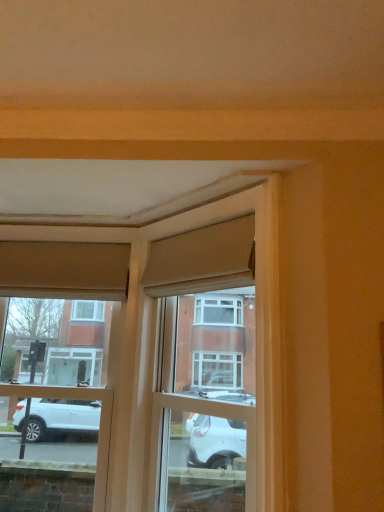
How much space does matte beige curtain at upper left, which is the first curtain from left to right, occupy vertically?

It is 14.52 inches.

What is the approximate height of matte beige curtain at upper center, which is counted as the second curtain, starting from the back?

matte beige curtain at upper center, which is counted as the second curtain, starting from the back, is 13.66 inches in height.

The height and width of the screenshot is (512, 384). What do you see at coordinates (64, 269) in the screenshot?
I see `matte glass window at center` at bounding box center [64, 269].

Locate an element on the screen. This screenshot has width=384, height=512. matte wood window frame at center is located at coordinates (257, 298).

At what (x,y) coordinates should I click in order to perform the action: click on matte beige curtain at upper left, marked as the 1th curtain in a back-to-front arrangement. Please return your answer as a coordinate pair (x, y). The width and height of the screenshot is (384, 512). Looking at the image, I should click on (64, 270).

Is point (199, 252) more distant than point (281, 452)?

That is True.

Which of these two, matte beige curtain at upper center, the second curtain in the left-to-right sequence, or matte wood window frame at center, is wider?

matte wood window frame at center.

Considering the positions of objects matte beige curtain at upper center, the first curtain positioned from the right, and matte wood window frame at center in the image provided, who is behind, matte beige curtain at upper center, the first curtain positioned from the right, or matte wood window frame at center?

matte beige curtain at upper center, the first curtain positioned from the right, is behind.

Would you say matte beige curtain at upper center, the second curtain in the left-to-right sequence, is to the left or to the right of matte wood window frame at center in the picture?

Based on their positions, matte beige curtain at upper center, the second curtain in the left-to-right sequence, is located to the left of matte wood window frame at center.

Would you say matte wood window frame at center is a long distance from matte beige curtain at upper center, which is counted as the second curtain, starting from the back?

No, matte wood window frame at center is not far from matte beige curtain at upper center, which is counted as the second curtain, starting from the back.

Does point (277, 234) come farther from viewer compared to point (147, 284)?

No.

From a real-world perspective, count 2nd curtains upward from the matte wood window frame at center and point to it. Please provide its 2D coordinates.

[(202, 259)]

The width and height of the screenshot is (384, 512). What are the coordinates of `window below the matte wood window frame at center (from a real-world perspective)` in the screenshot? It's located at [x=64, y=269].

From a real-world perspective, which object rests below the other?

matte glass window at center.

Based on their sizes in the image, would you say matte glass window at center is bigger or smaller than matte wood window frame at center?

matte glass window at center is smaller than matte wood window frame at center.

Are matte glass window at center and matte wood window frame at center making contact?

No, matte glass window at center is not touching matte wood window frame at center.

How far apart are matte glass window at center and matte beige curtain at upper center, the first curtain positioned from the right?

55.81 centimeters.

Considering the sizes of objects matte glass window at center and matte beige curtain at upper center, acting as the 1th curtain starting from the front, in the image provided, who is thinner, matte glass window at center or matte beige curtain at upper center, acting as the 1th curtain starting from the front,?

With smaller width is matte beige curtain at upper center, acting as the 1th curtain starting from the front.

At what (x,y) coordinates should I click in order to perform the action: click on curtain in front of the matte glass window at center. Please return your answer as a coordinate pair (x, y). This screenshot has height=512, width=384. Looking at the image, I should click on (202, 259).

How different are the orientations of matte glass window at center and matte beige curtain at upper center, which is counted as the second curtain, starting from the back, in degrees?

45.3 degrees separate the facing orientations of matte glass window at center and matte beige curtain at upper center, which is counted as the second curtain, starting from the back.

At what (x,y) coordinates should I click in order to perform the action: click on window frame directly beneath the matte beige curtain at upper left, marked as the 2th curtain in a front-to-back arrangement (from a real-world perspective). Please return your answer as a coordinate pair (x, y). The image size is (384, 512). Looking at the image, I should click on (257, 298).

How different are the orientations of matte wood window frame at center and matte beige curtain at upper left, the 2th curtain viewed from the right, in degrees?

matte wood window frame at center and matte beige curtain at upper left, the 2th curtain viewed from the right, are facing 45.3 degrees away from each other.

Which of these two, matte wood window frame at center or matte beige curtain at upper left, the 2th curtain viewed from the right, is bigger?

matte wood window frame at center is bigger.

Which is more to the left, matte wood window frame at center or matte beige curtain at upper left, which is the first curtain from left to right?

matte beige curtain at upper left, which is the first curtain from left to right, is more to the left.

From the image's perspective, is matte glass window at center positioned above or below matte beige curtain at upper left, marked as the 1th curtain in a back-to-front arrangement?

matte glass window at center is situated lower than matte beige curtain at upper left, marked as the 1th curtain in a back-to-front arrangement, in the image.

Does point (97, 503) lie behind point (108, 262)?

No, (97, 503) is closer to viewer.

Would you say matte glass window at center is to the left or to the right of matte beige curtain at upper left, marked as the 1th curtain in a back-to-front arrangement, in the picture?

In the image, matte glass window at center appears on the left side of matte beige curtain at upper left, marked as the 1th curtain in a back-to-front arrangement.

Is matte glass window at center placed right next to matte beige curtain at upper left, the 2th curtain viewed from the right?

Yes, matte glass window at center and matte beige curtain at upper left, the 2th curtain viewed from the right, clearly make contact.

From a real-world perspective, between matte beige curtain at upper center, the first curtain positioned from the right, and matte glass window at center, who is vertically higher?

matte beige curtain at upper center, the first curtain positioned from the right, is physically above.

Is matte beige curtain at upper center, the second curtain in the left-to-right sequence, surrounding matte glass window at center?

No, matte glass window at center is not surrounded by matte beige curtain at upper center, the second curtain in the left-to-right sequence.

Find the location of a particular element. the 2nd curtain to the right when counting from the matte glass window at center is located at coordinates (202, 259).

This screenshot has height=512, width=384. I want to click on window frame in front of the matte beige curtain at upper center, acting as the 1th curtain starting from the front, so click(257, 298).

You are a GUI agent. You are given a task and a screenshot of the screen. Output one action in this format:
    pyautogui.click(x=<x>, y=<y>)
    Task: Click on the 2nd curtain above the matte wood window frame at center (from the image's perspective)
    The width and height of the screenshot is (384, 512).
    Given the screenshot: What is the action you would take?
    pyautogui.click(x=202, y=259)

Estimate the real-world distances between objects in this image. Which object is further from matte wood window frame at center, matte glass window at center or matte beige curtain at upper left, marked as the 1th curtain in a back-to-front arrangement?

matte glass window at center lies further to matte wood window frame at center than the other object.

When comparing their distances from matte beige curtain at upper center, acting as the 1th curtain starting from the front, does matte wood window frame at center or matte beige curtain at upper left, which is the first curtain from left to right, seem closer?

matte wood window frame at center lies closer to matte beige curtain at upper center, acting as the 1th curtain starting from the front, than the other object.

Estimate the real-world distances between objects in this image. Which object is closer to matte glass window at center, matte wood window frame at center or matte beige curtain at upper left, marked as the 2th curtain in a front-to-back arrangement?

matte beige curtain at upper left, marked as the 2th curtain in a front-to-back arrangement, is closer to matte glass window at center.

Looking at the image, which one is located further to matte beige curtain at upper left, marked as the 1th curtain in a back-to-front arrangement, matte wood window frame at center or matte glass window at center?

The object further to matte beige curtain at upper left, marked as the 1th curtain in a back-to-front arrangement, is matte wood window frame at center.

Considering their positions, is matte beige curtain at upper left, marked as the 1th curtain in a back-to-front arrangement, positioned closer to matte glass window at center than matte beige curtain at upper center, which is counted as the second curtain, starting from the back?

matte beige curtain at upper left, marked as the 1th curtain in a back-to-front arrangement.

Based on their spatial positions, is matte glass window at center or matte beige curtain at upper left, the 2th curtain viewed from the right, closer to matte beige curtain at upper center, the second curtain in the left-to-right sequence?

The object closer to matte beige curtain at upper center, the second curtain in the left-to-right sequence, is matte beige curtain at upper left, the 2th curtain viewed from the right.

Looking at the image, which one is located further to matte wood window frame at center, matte beige curtain at upper left, the 2th curtain viewed from the right, or matte beige curtain at upper center, which is counted as the second curtain, starting from the back?

matte beige curtain at upper left, the 2th curtain viewed from the right, is positioned further to the anchor matte wood window frame at center.

Looking at the image, which one is located further to matte wood window frame at center, matte beige curtain at upper center, the first curtain positioned from the right, or matte glass window at center?

matte glass window at center lies further to matte wood window frame at center than the other object.

Identify the location of window between matte wood window frame at center and matte beige curtain at upper left, which is the first curtain from left to right, in the front-back direction. (64, 269).

Locate an element on the screen. This screenshot has width=384, height=512. curtain between matte wood window frame at center and matte beige curtain at upper left, marked as the 2th curtain in a front-to-back arrangement, in the front-back direction is located at coordinates (202, 259).

Identify the location of curtain between matte glass window at center and matte beige curtain at upper center, which is counted as the second curtain, starting from the back, in the horizontal direction. (64, 270).